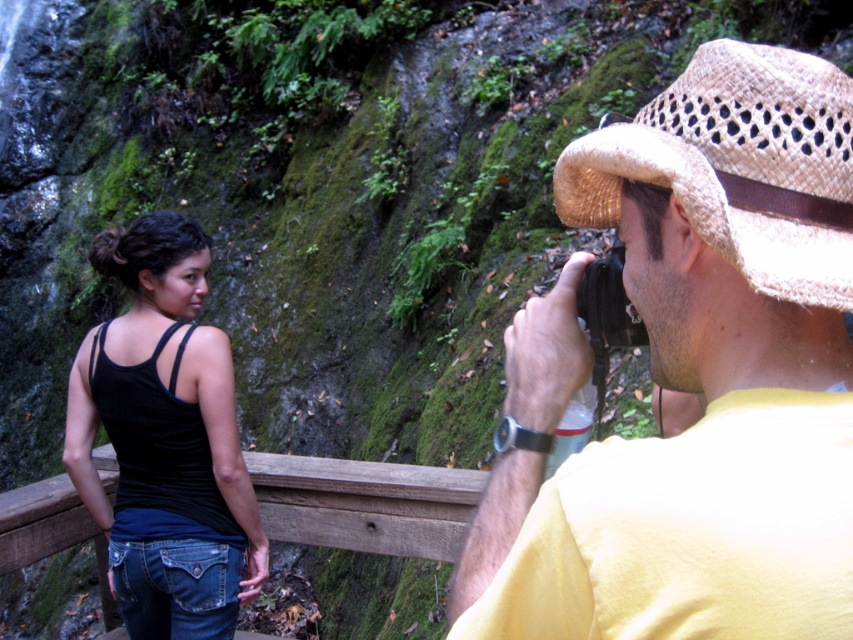
You are a photographer trying to capture a clear shot of both the black matte tank top at center and the woven straw cowboy hat at upper right. Which object should you focus on first to ensure both are in focus?

The black matte tank top at center is closer to the viewer than the woven straw cowboy hat at upper right. To ensure both are in focus, focus on the black matte tank top at center first, as it is closer, and the depth of field may naturally include the farther object.

You are standing in a forest near a waterfall and want to take a photo of the black matte tank top at center. The beige straw hat at upper right is blocking your view. Can you move around to the left side to get a clear shot?

The beige straw hat at upper right is closer to the viewer than the black matte tank top at center, so moving to the left side might not help as the hat is still in front. You might need to move around to the right side instead to get a clear view of the black matte tank top at center.

You are a photographer trying to position two hats in a photo shoot. You have a beige straw hat at upper right and a woven straw cowboy hat at upper right. Which hat should you move to the lower left to ensure the bigger one is closer to the woman in the scene?

You should move the woven straw cowboy hat at upper right to the lower left because the beige straw hat at upper right is bigger and should remain closer to the woman.